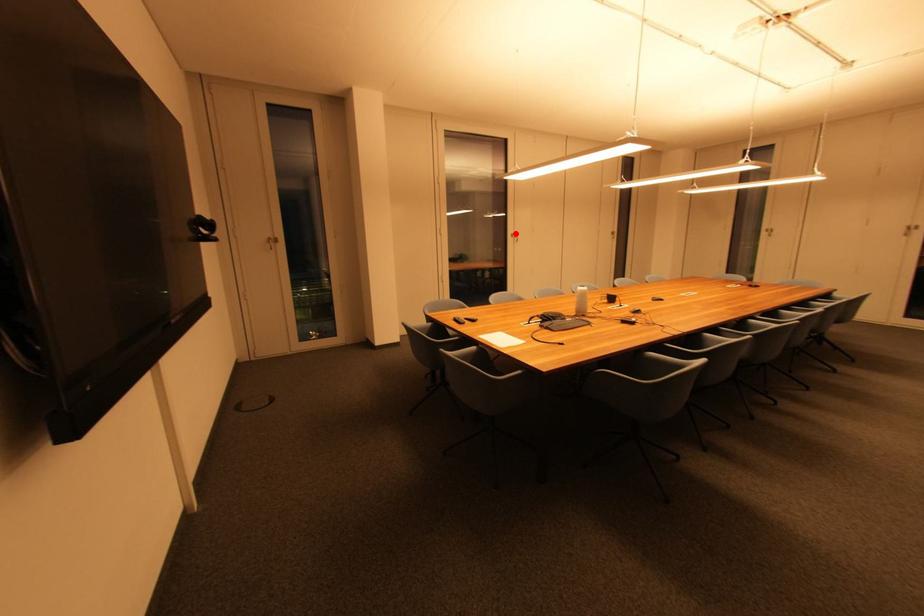
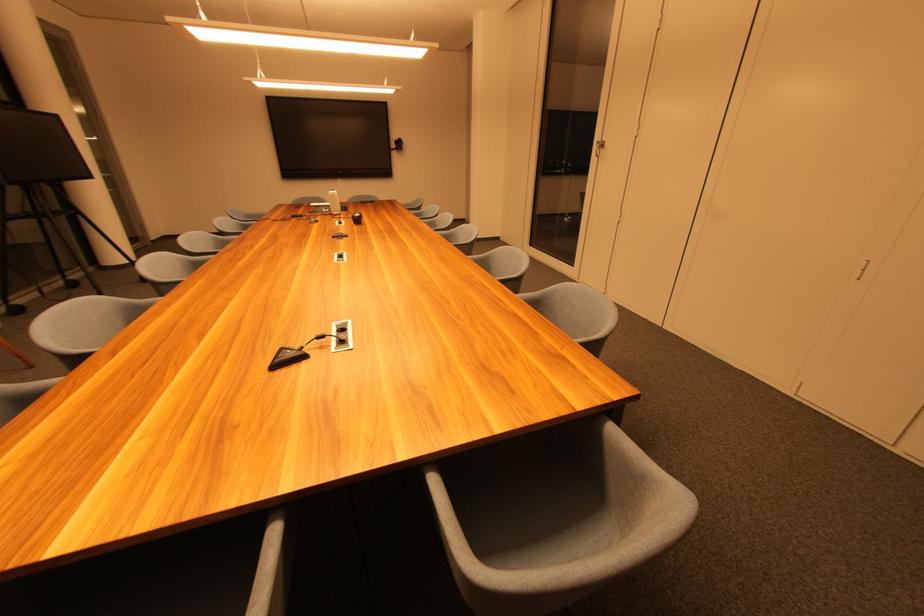
Question: I am providing you with two images of the same scene from different viewpoints. A red point is marked on the first image. Is the red point's position out of view in image 2?

Choices:
 (A) Yes
 (B) No

Answer: (B)